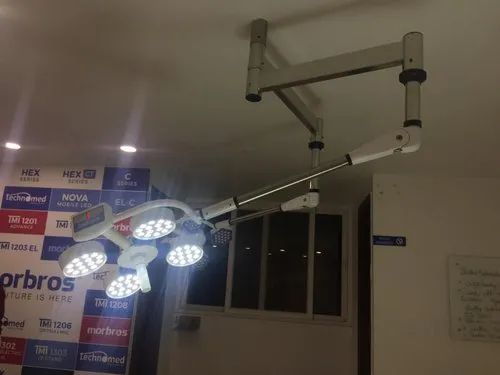
You are a GUI agent. You are given a task and a screenshot of the screen. Output one action in this format:
    pyautogui.click(x=<x>, y=<y>)
    Task: Click on the poster
    
    Given the screenshot: What is the action you would take?
    pyautogui.click(x=467, y=292)